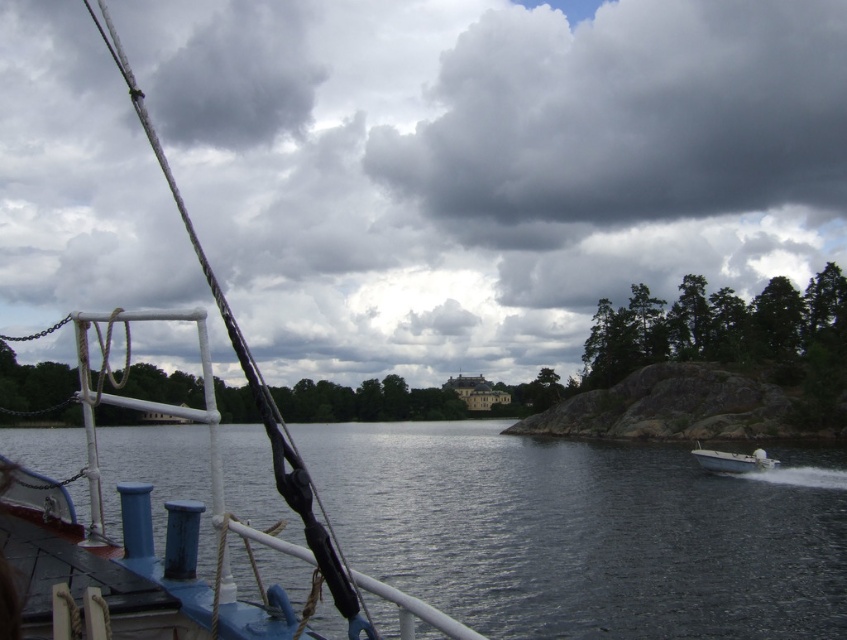
You are an observer on the boat deck. You see the dark blue water at center and the dark gray fluffy cloud at upper center. Which object is located below the other?

The dark blue water at center is positioned under dark gray fluffy cloud at upper center, so the dark blue water at center is below the dark gray fluffy cloud at upper center.

You are on a boat and looking at the sky. You see two clouds, the dark gray cloud at upper center and the dark gray fluffy cloud at upper center. Which cloud is lower in the sky?

The dark gray cloud at upper center is lower than the dark gray fluffy cloud at upper center.